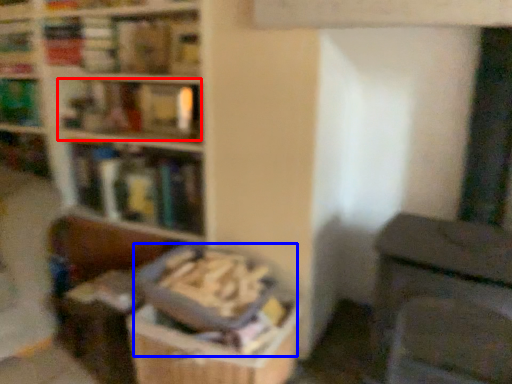
Question: Which point is closer to the camera, book (highlighted by a red box) or book (highlighted by a blue box)?

Choices:
 (A) book
 (B) book

Answer: (B)